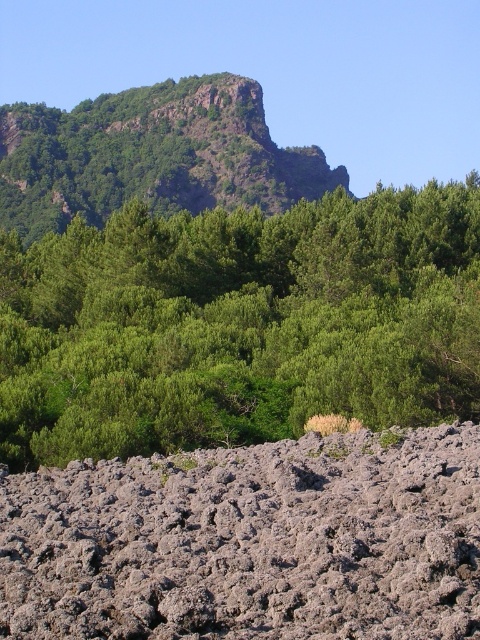
Based on the photo, does green leafy tree at upper center appear under rugged rock mountain at upper center?

Indeed, green leafy tree at upper center is positioned under rugged rock mountain at upper center.

Is point (115, 339) positioned after point (280, 208)?

No, (115, 339) is closer to viewer.

Find the location of a particular element. Image resolution: width=480 pixels, height=640 pixels. green leafy tree at upper center is located at coordinates (240, 323).

Which of these two, green leafy tree at upper center or gray rough rock at lower center, stands taller?

Standing taller between the two is green leafy tree at upper center.

Locate an element on the screen. The height and width of the screenshot is (640, 480). green leafy tree at upper center is located at coordinates (240, 323).

Does gray rough rock at lower center appear under rugged rock mountain at upper center?

Yes.

Is point (73, 544) closer to viewer compared to point (93, 182)?

Yes, it is.

Image resolution: width=480 pixels, height=640 pixels. Find the location of `gray rough rock at lower center`. gray rough rock at lower center is located at coordinates (250, 541).